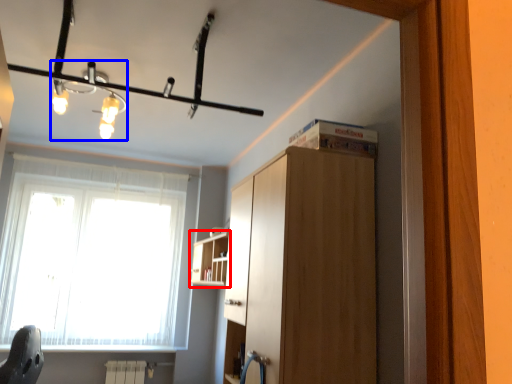
Question: Which point is further to the camera, shelf (highlighted by a red box) or light fixture (highlighted by a blue box)?

Choices:
 (A) shelf
 (B) light fixture

Answer: (A)